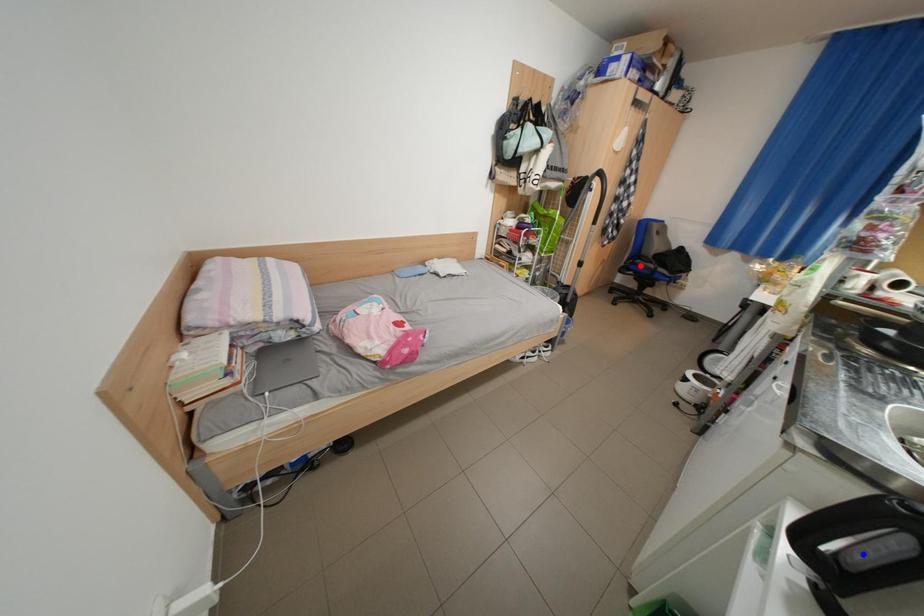
Question: Which of the two points in the image is closer to the camera?

Choices:
 (A) Blue point is closer.
 (B) Red point is closer.

Answer: (A)